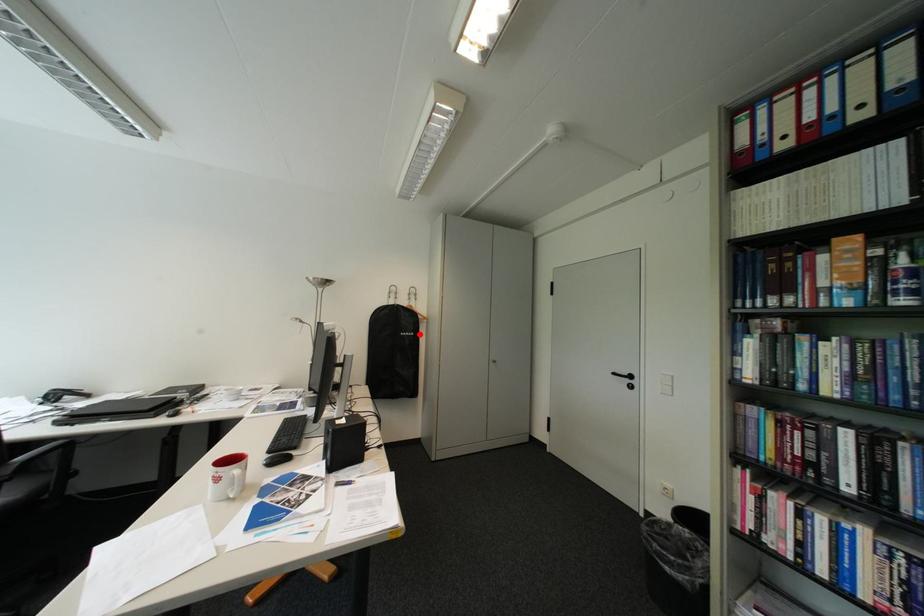
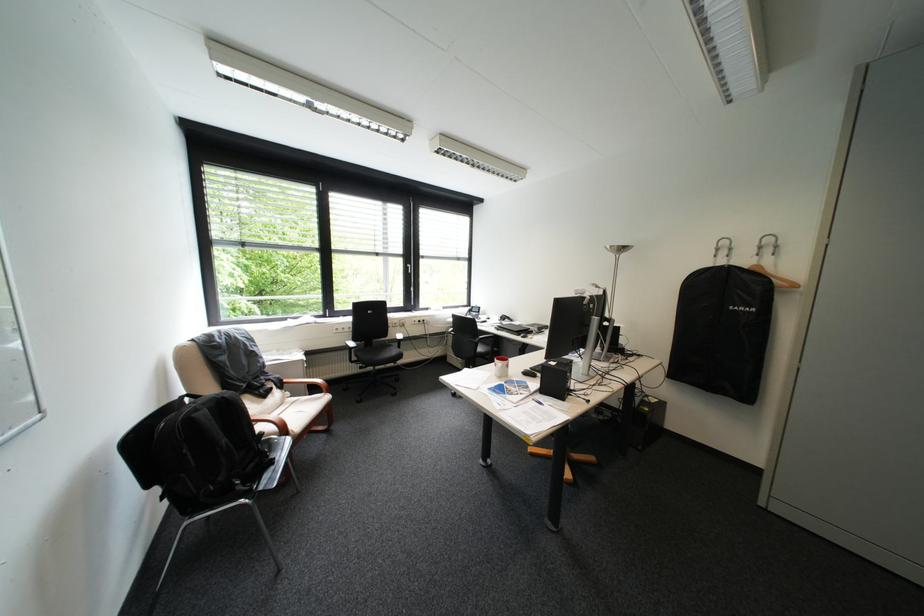
Locate, in the second image, the point that corresponds to the highlighted location in the first image.

(755, 309)